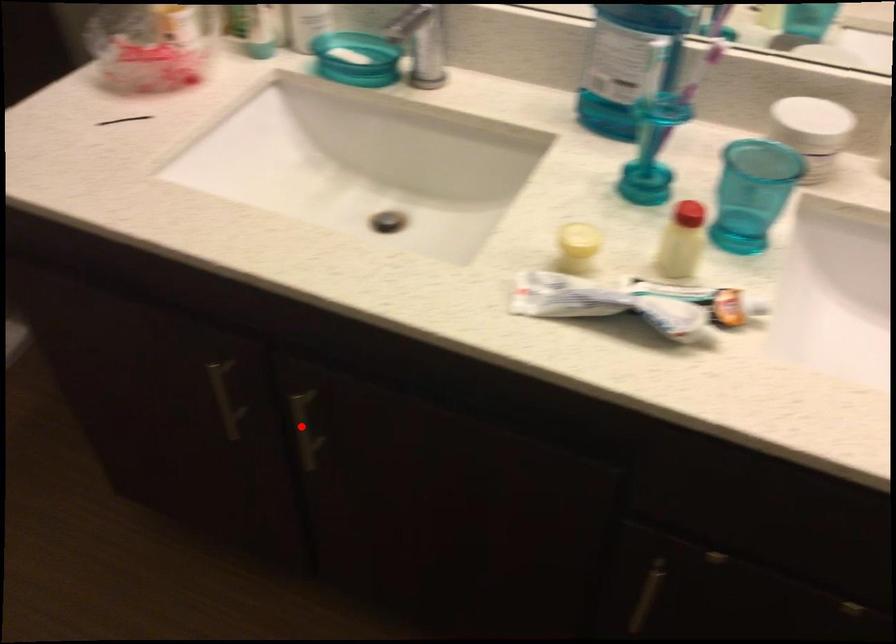
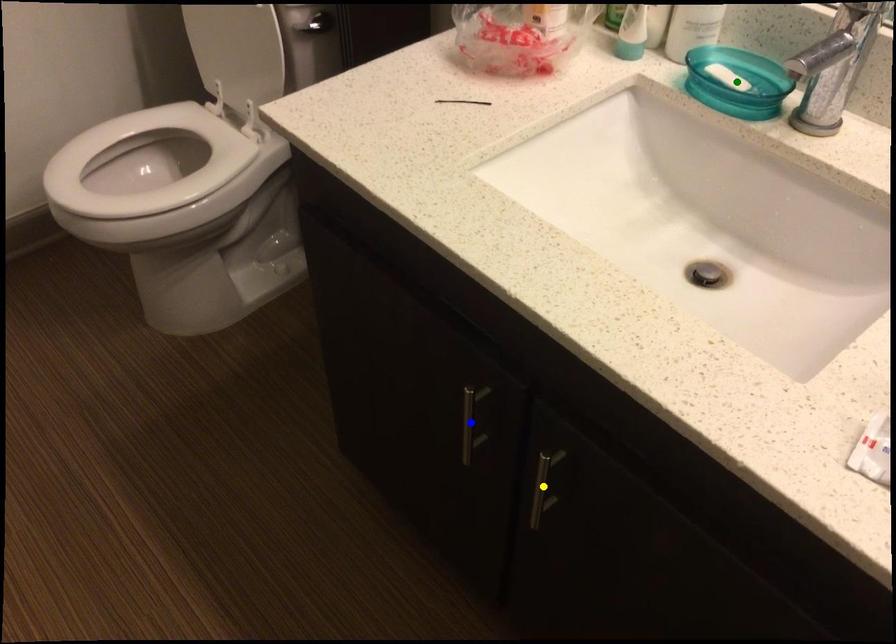
Question: I am providing you with two images of the same scene from different viewpoints. A red point is marked on the first image. You are given multiple points on the second image. Can you choose the point in image 2 that corresponds to the point in image 1?

Choices:
 (A) blue point
 (B) green point
 (C) yellow point

Answer: (C)